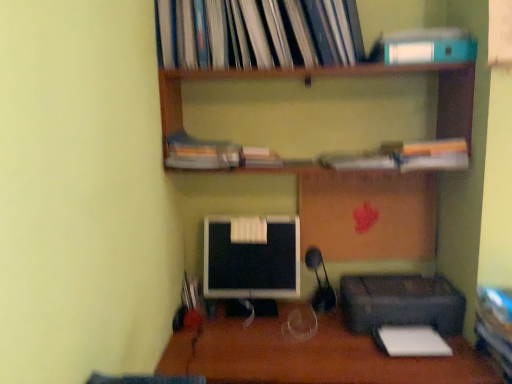
You are a GUI agent. You are given a task and a screenshot of the screen. Output one action in this format:
    pyautogui.click(x=<x>, y=<y>)
    Task: Click on the vacant area that is in front of white paper at lower right
    This screenshot has height=384, width=512.
    Given the screenshot: What is the action you would take?
    pyautogui.click(x=426, y=369)